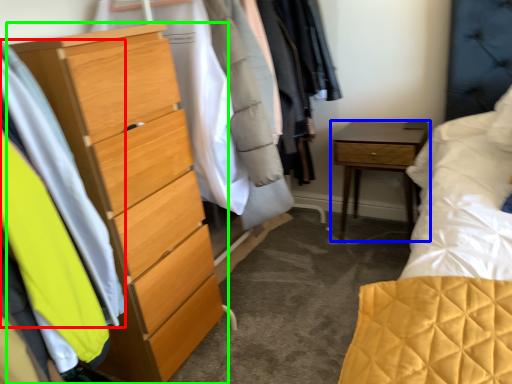
Question: Based on their relative distances, which object is farther from clothing (highlighted by a red box)? Choose from nightstand (highlighted by a blue box) and chest of drawers (highlighted by a green box).

Choices:
 (A) nightstand
 (B) chest of drawers

Answer: (A)